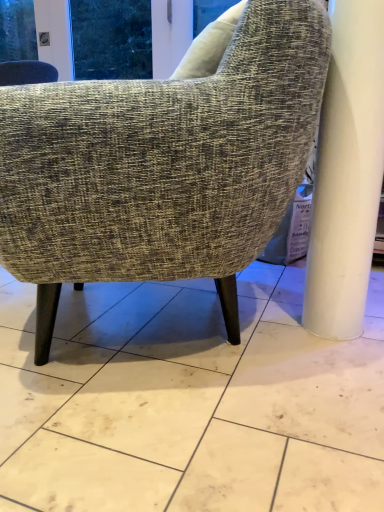
Question: Considering their positions, is white marble floor at center located in front of or behind textured gray fabric chair at center?

Choices:
 (A) behind
 (B) front

Answer: (B)

Question: In terms of width, does white marble floor at center look wider or thinner when compared to textured gray fabric chair at center?

Choices:
 (A) thin
 (B) wide

Answer: (B)

Question: In terms of size, does white marble floor at center appear bigger or smaller than textured gray fabric chair at center?

Choices:
 (A) big
 (B) small

Answer: (B)

Question: Is point (283, 39) closer or farther from the camera than point (372, 353)?

Choices:
 (A) farther
 (B) closer

Answer: (B)

Question: Looking at their shapes, would you say textured gray fabric chair at center is wider or thinner than white marble floor at center?

Choices:
 (A) thin
 (B) wide

Answer: (A)

Question: Is textured gray fabric chair at center inside or outside of white marble floor at center?

Choices:
 (A) outside
 (B) inside

Answer: (A)

Question: Is textured gray fabric chair at center in front of or behind white marble floor at center in the image?

Choices:
 (A) front
 (B) behind

Answer: (B)